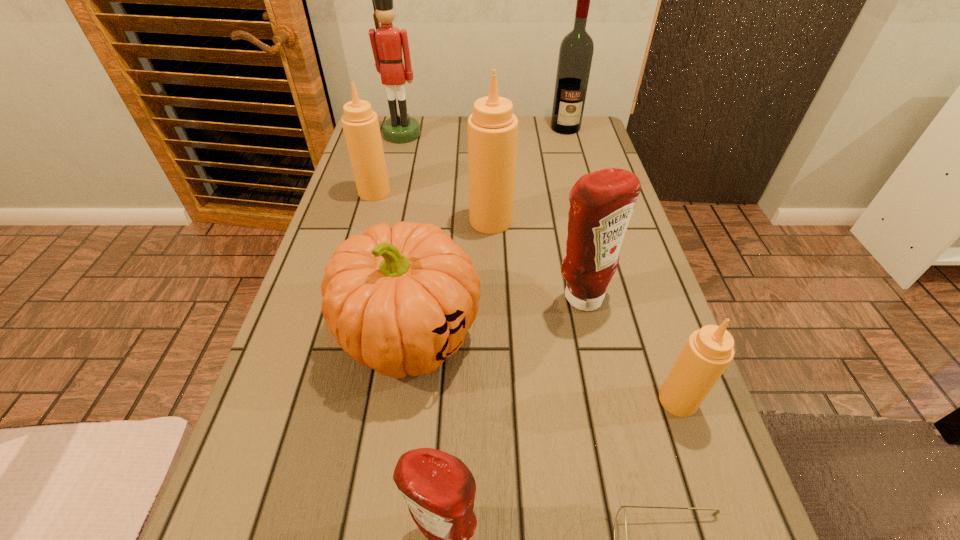
The height and width of the screenshot is (540, 960). I want to click on green nutcracker, so click(x=387, y=42).

Where is `alcohol`? The width and height of the screenshot is (960, 540). alcohol is located at coordinates (576, 50).

Identify the location of the second nearest tan condiment. (493, 128).

The height and width of the screenshot is (540, 960). Find the location of `the tallest condiment`. the tallest condiment is located at coordinates (493, 128).

At what (x,y) coordinates should I click in order to perform the action: click on the third farthest object. Please return your answer as a coordinate pair (x, y). Looking at the image, I should click on (360, 123).

This screenshot has height=540, width=960. Find the location of `the farthest tan condiment`. the farthest tan condiment is located at coordinates point(360,123).

Image resolution: width=960 pixels, height=540 pixels. Identify the location of the bigger red condiment. (601, 203).

I want to click on the second condiment from right to left, so click(601, 203).

Identify the location of pumpkin. The image size is (960, 540). (399, 300).

Find the location of a particular element. the rightmost tan condiment is located at coordinates (708, 351).